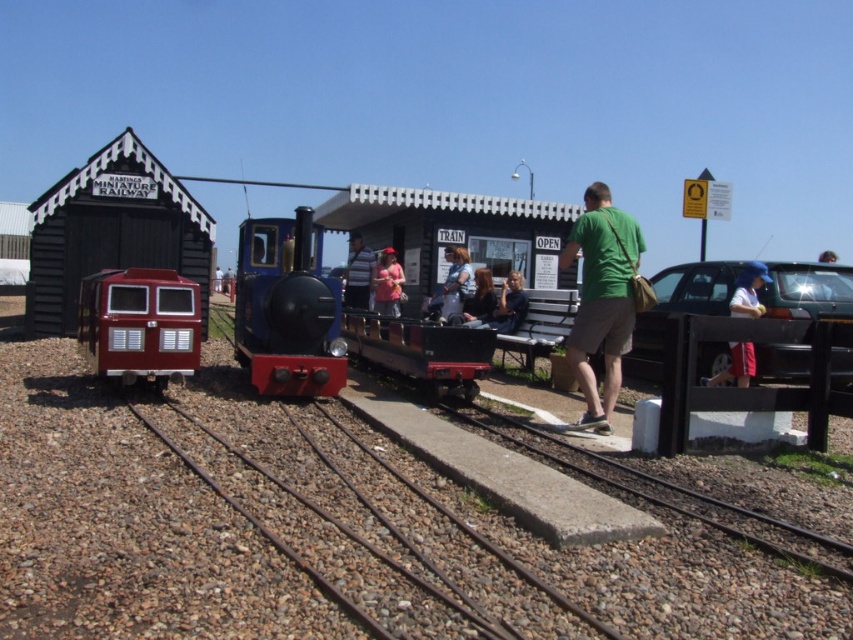
Question: Which of the following is the closest to the observer?

Choices:
 (A) matte pink shirt at center
 (B) metallic silver car at right

Answer: (B)

Question: Is light blue denim shorts at right to the left of matte blue shirt at center from the viewer's perspective?

Choices:
 (A) no
 (B) yes

Answer: (A)

Question: Observing the image, what is the correct spatial positioning of light blue denim shorts at right in reference to matte blue shirt at center?

Choices:
 (A) left
 (B) right

Answer: (B)

Question: Which point is closer to the camera taking this photo?

Choices:
 (A) (347, 273)
 (B) (489, 620)
 (C) (244, 316)

Answer: (B)

Question: Which point is closer to the camera taking this photo?

Choices:
 (A) (426, 308)
 (B) (247, 220)
 (C) (630, 490)

Answer: (C)

Question: Is gray concrete train track at lower center thinner than matte pink shirt at center?

Choices:
 (A) yes
 (B) no

Answer: (B)